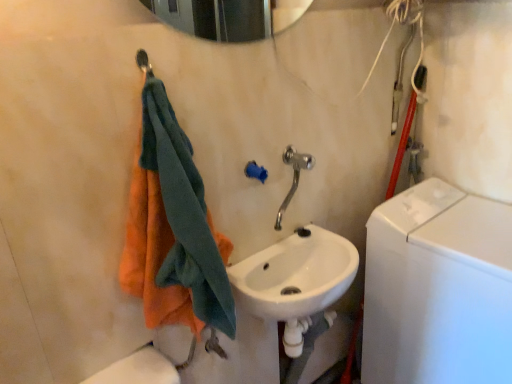
Question: Considering the positions of white glossy sink at center and orange cotton towel at left in the image, is white glossy sink at center bigger or smaller than orange cotton towel at left?

Choices:
 (A) big
 (B) small

Answer: (B)

Question: In terms of height, does white glossy sink at center look taller or shorter compared to orange cotton towel at left?

Choices:
 (A) tall
 (B) short

Answer: (B)

Question: Which object is the closest to the white glossy sink at center?

Choices:
 (A) metallic silver shower at upper left
 (B) polished chrome faucet at center
 (C) white glossy washing machine at right
 (D) orange cotton towel at left

Answer: (B)

Question: Estimate the real-world distances between objects in this image. Which object is farther from the white glossy sink at center?

Choices:
 (A) polished chrome faucet at center
 (B) orange cotton towel at left
 (C) metallic silver shower at upper left
 (D) white glossy washing machine at right

Answer: (C)